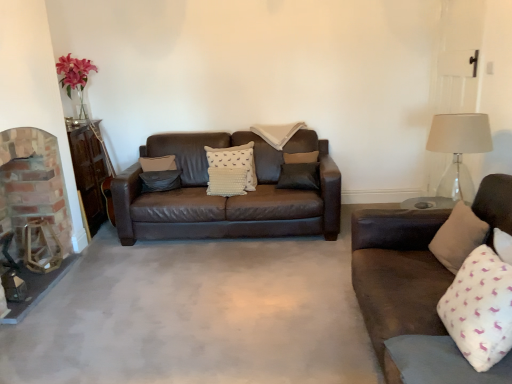
Question: In the image, is beige fabric pillow at right, which ranks as the 2th pillow in front-to-back order, positioned in front of or behind beige fabric pillow at center, the first pillow from the back?

Choices:
 (A) behind
 (B) front

Answer: (B)

Question: Is beige fabric pillow at right, the fourth pillow in the back-to-front sequence, bigger or smaller than beige fabric pillow at center, the first pillow from the back?

Choices:
 (A) small
 (B) big

Answer: (A)

Question: Considering the real-world distances, which object is farthest from the brick fireplace at left?

Choices:
 (A) matte gray pillow at center, the 2th pillow positioned from the back
 (B) white textured pillow at center, marked as the 3th pillow in a front-to-back arrangement
 (C) translucent glass table lamp at right
 (D) beige fabric pillow at center, the first pillow from the back
 (E) beige fabric pillow at right, which ranks as the 2th pillow in front-to-back order

Answer: (C)

Question: Which is farther from the white soft pillow at right, which ranks as the second pillow in right-to-left order?

Choices:
 (A) matte gray pillow at center, the 4th pillow in the front-to-back sequence
 (B) beige fabric pillow at center, the first pillow from the back
 (C) white textured pillow at center, the third pillow positioned from the back
 (D) translucent glass table lamp at right
 (E) beige fabric pillow at right, the fourth pillow in the back-to-front sequence

Answer: (A)